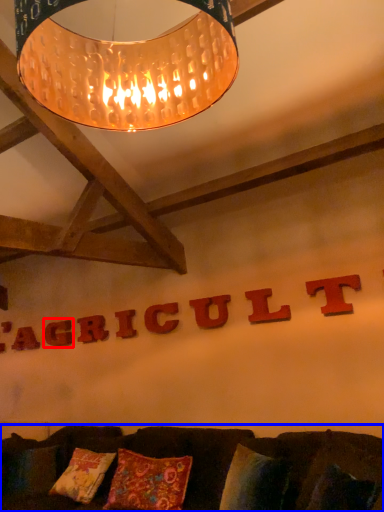
Question: Which point is closer to the camera, letter (highlighted by a red box) or furniture (highlighted by a blue box)?

Choices:
 (A) letter
 (B) furniture

Answer: (B)